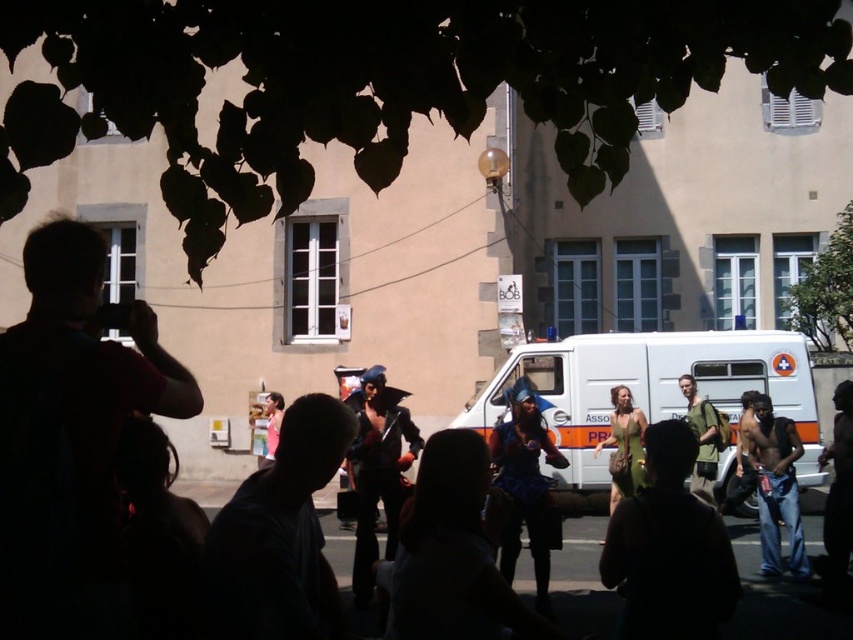
You are a photographer standing in the crowd at the event. You want to take a photo of both the shiny black costume at center and the denim jeans at lower right. Which object should you focus on first to ensure both are in sharp focus?

The shiny black costume at center is closer to the viewer than the denim jeans at lower right. To ensure both are in sharp focus, you should focus on the shiny black costume at center first, as it is the closer object.

From the picture: You are a photographer trying to capture the performer in the shiny black costume at center and the person in denim jeans at lower right in the same frame. Based on their positions, which direction should you move to ensure both are visible in your shot?

Since the shiny black costume at center is to the left of denim jeans at lower right, you should move to the right to ensure both are visible in your shot.

You are a photographer trying to capture a photo of the shiny black costume at center and the green fabric backpack at right. Based on their sizes, which object should you focus on to ensure both fit in the frame without cropping?

The shiny black costume at center might be wider than the green fabric backpack at right, so focusing on the shiny black costume at center would allow both to fit in the frame since it is the wider object.